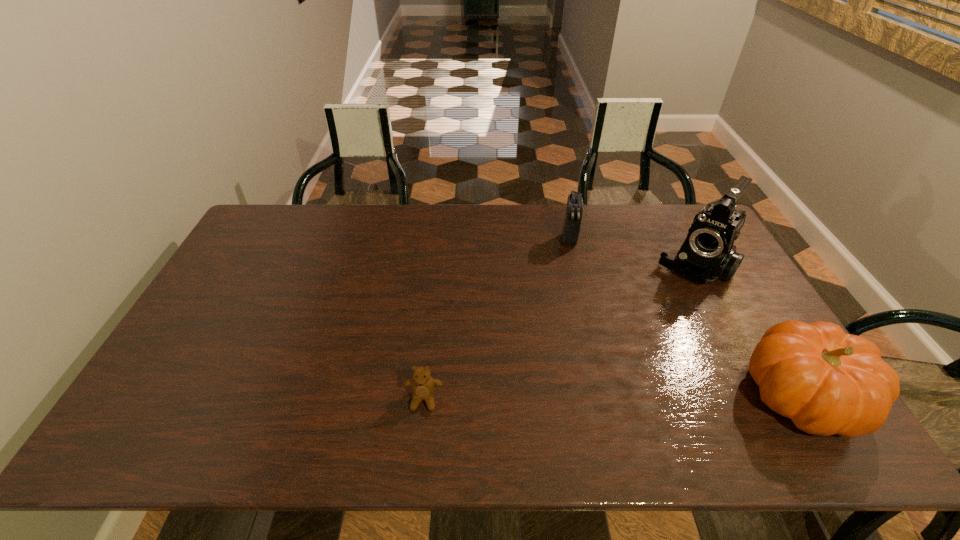
In order to click on the shortest object in this screenshot , I will do `click(423, 386)`.

You are a GUI agent. You are given a task and a screenshot of the screen. Output one action in this format:
    pyautogui.click(x=<x>, y=<y>)
    Task: Click on the teddy bear
    
    Given the screenshot: What is the action you would take?
    pyautogui.click(x=423, y=386)

At what (x,y) coordinates should I click in order to perform the action: click on pumpkin. Please return your answer as a coordinate pair (x, y). Looking at the image, I should click on (827, 382).

I want to click on camcorder, so click(708, 253).

Find the location of a particular element. The image size is (960, 540). the third object from right to left is located at coordinates (572, 222).

You are a GUI agent. You are given a task and a screenshot of the screen. Output one action in this format:
    pyautogui.click(x=<x>, y=<y>)
    Task: Click on the clutch bag
    
    Given the screenshot: What is the action you would take?
    pyautogui.click(x=572, y=222)

The height and width of the screenshot is (540, 960). I want to click on vacant space positioned on the back of the pumpkin, so click(x=742, y=297).

Find the location of a particular element. Image resolution: width=960 pixels, height=540 pixels. vacant space situated 0.240m on the lens mount of the camcorder is located at coordinates 640,328.

Find the location of a particular element. This screenshot has height=540, width=960. vacant area situated on the lens mount of the camcorder is located at coordinates (615, 358).

Find the location of a particular element. free space located 0.290m on the lens mount of the camcorder is located at coordinates click(x=632, y=338).